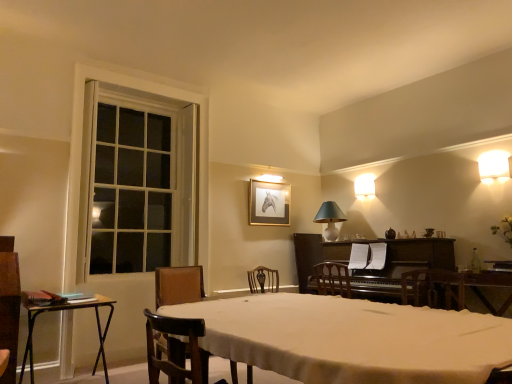
Where is `free space above white wood window at left (from a real-world perspective)`? free space above white wood window at left (from a real-world perspective) is located at coordinates (152, 83).